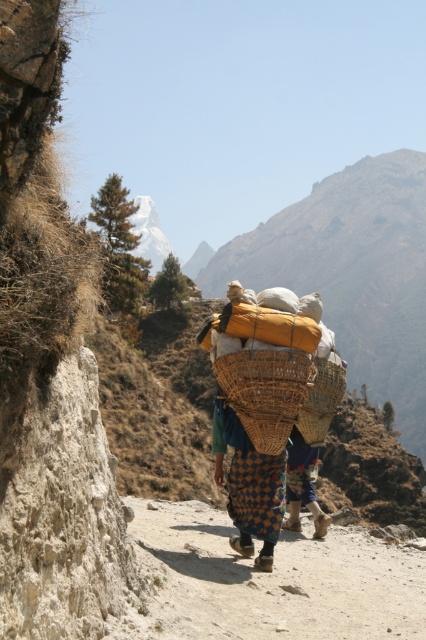
You are standing at the camera position and want to reach the point at coordinates [206,330]. If your walking speed is 3 feet per second, how many seconds will it take you to reach that point?

The distance between the point at coordinates [206,330] and the camera is 57.06 feet. At a speed of 3 feet per second, it will take 57.06 divided by 3, which is approximately 19.02 seconds to reach the point.

You are planning a hiking trip and see the rugged brown mountain at center and the brown woven basket at center in the image. Which object is wider?

The rugged brown mountain at center is wider than the brown woven basket at center.

You are planning to hike along the dusty gravel path at center while carrying the woven bamboo basket at center. Considering the height difference between them, will the basket be visible above the path?

The dusty gravel path at center has a greater height compared to woven bamboo basket at center, so the basket will not be visible above the path.